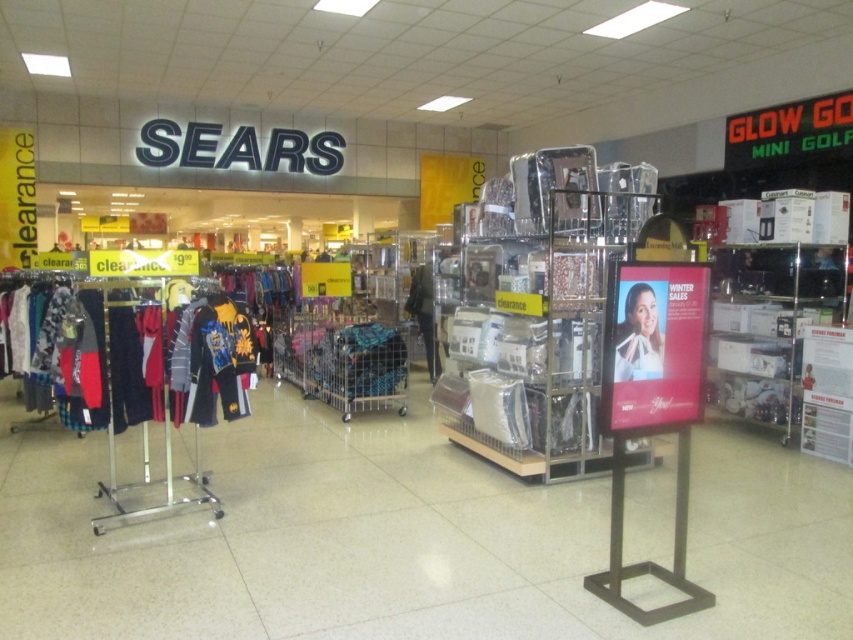
Question: Which point appears farthest from the camera in this image?

Choices:
 (A) (570, 301)
 (B) (144, 380)
 (C) (618, 380)

Answer: (A)

Question: Does clear plastic shelves at center have a smaller size compared to white fabric dress at center?

Choices:
 (A) no
 (B) yes

Answer: (A)

Question: Which point is closer to the camera?

Choices:
 (A) (74, 301)
 (B) (648, 365)
 (C) (451, 362)

Answer: (B)

Question: Does matte black jacket at left have a smaller size compared to white fabric dress at center?

Choices:
 (A) no
 (B) yes

Answer: (A)

Question: Considering the real-world distances, which object is closest to the matte black jacket at left?

Choices:
 (A) clear plastic shelves at center
 (B) black fabric dress at center

Answer: (A)

Question: Is white fabric dress at center wider than black fabric dress at center?

Choices:
 (A) no
 (B) yes

Answer: (A)